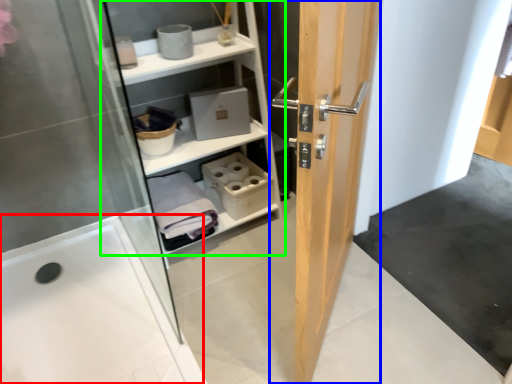
Question: Which object is the farthest from bath (highlighted by a red box)? Choose among these: door (highlighted by a blue box) or shelf (highlighted by a green box).

Choices:
 (A) door
 (B) shelf

Answer: (A)